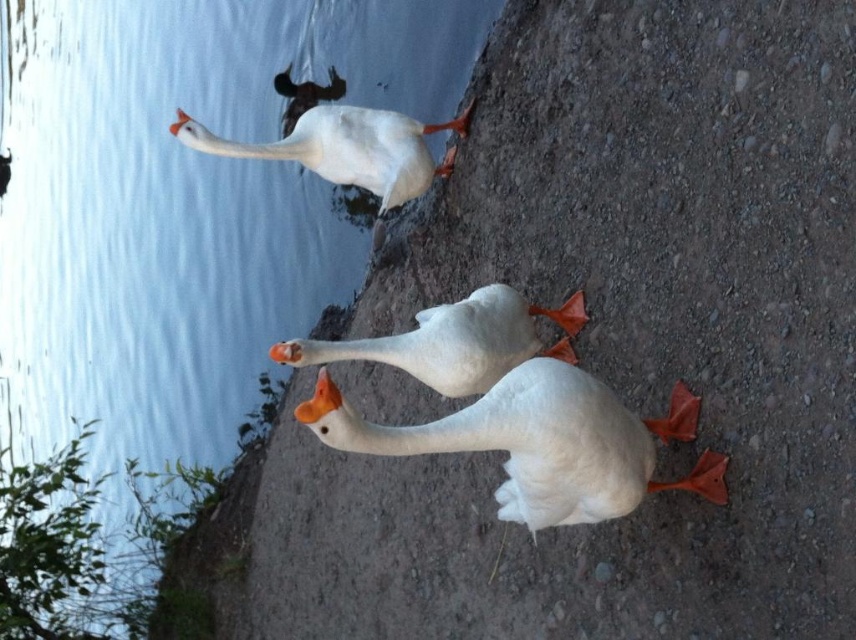
Question: Which point appears closest to the camera in this image?

Choices:
 (A) (325, 387)
 (B) (296, 364)
 (C) (146, 102)
 (D) (383, 125)

Answer: (A)

Question: Is clear blue water at upper left in front of white matte swan at center?

Choices:
 (A) yes
 (B) no

Answer: (B)

Question: Is clear blue water at upper left smaller than white matte swan at center?

Choices:
 (A) no
 (B) yes

Answer: (A)

Question: Which of the following is the farthest from the observer?

Choices:
 (A) (181, 124)
 (B) (302, 362)

Answer: (A)

Question: Does clear blue water at upper left come in front of white matte swan at center?

Choices:
 (A) no
 (B) yes

Answer: (A)

Question: Which of the following is the farthest from the observer?

Choices:
 (A) clear blue water at upper left
 (B) white matte swan at upper center
 (C) white matte swan at center

Answer: (A)